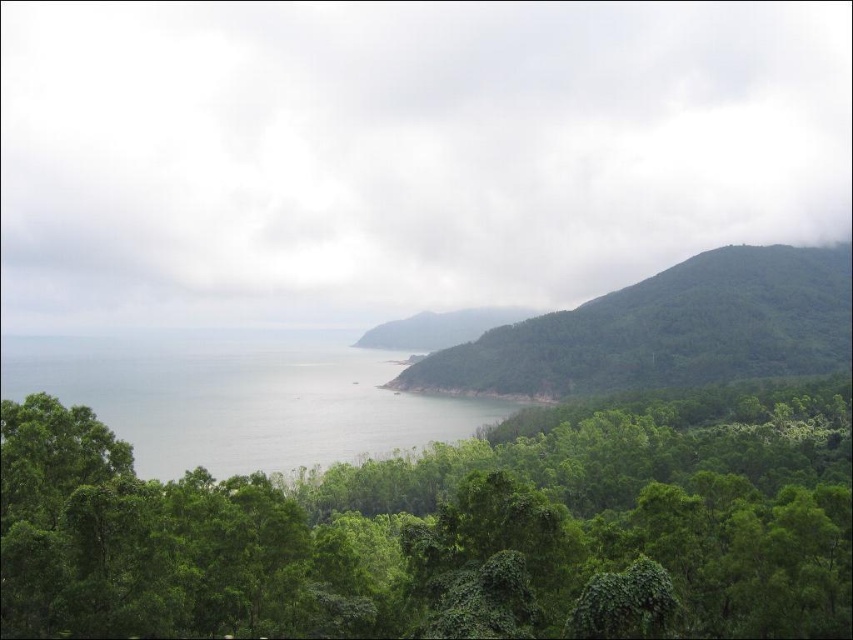
Can you confirm if green leafy trees at center is positioned to the right of green leafy hillside at right?

Incorrect, green leafy trees at center is not on the right side of green leafy hillside at right.

Is green leafy trees at center closer to camera compared to green leafy hillside at right?

Yes.

Is point (515, 634) less distant than point (606, 371)?

That is True.

I want to click on green leafy trees at center, so click(445, 531).

Which is more to the left, clear water at lower left or green leafy hillside at center?

clear water at lower left

Can you confirm if clear water at lower left is thinner than green leafy hillside at center?

No, clear water at lower left is not thinner than green leafy hillside at center.

What are the coordinates of `clear water at lower left` in the screenshot? It's located at (241, 397).

What do you see at coordinates (241, 397) in the screenshot?
I see `clear water at lower left` at bounding box center [241, 397].

Measure the distance between point (4, 348) and camera.

Point (4, 348) is 746.86 meters from camera.

Identify the location of clear water at lower left. (241, 397).